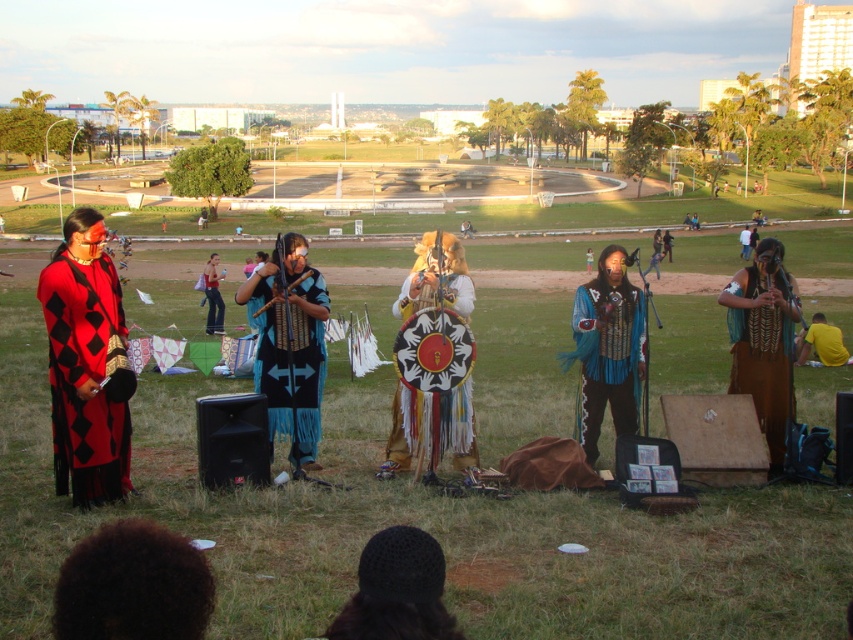
Question: Which of the following is the farthest from the observer?

Choices:
 (A) black knitted hat at lower center
 (B) yellow fabric at lower right
 (C) dark brown curly hair at lower left
 (D) blue fabric shawl at center

Answer: (D)

Question: Estimate the real-world distances between objects in this image. Which object is farther from the red/black checkered fabric at left?

Choices:
 (A) blue fringed vest at center
 (B) blue fringed dress at center
 (C) brown suede skirt at right

Answer: (B)

Question: Can you confirm if blue feathered vest at center is smaller than blue fabric dress at center?

Choices:
 (A) yes
 (B) no

Answer: (A)

Question: Can you confirm if blue fringed vest at center is positioned to the left of brown suede skirt at right?

Choices:
 (A) no
 (B) yes

Answer: (B)

Question: Estimate the real-world distances between objects in this image. Which object is farther from the dark brown curly hair at lower left?

Choices:
 (A) blue fabric dress at center
 (B) blue fabric shawl at center
 (C) multicolored fringed shield at center
 (D) blue fringed dress at center

Answer: (B)

Question: Does brown suede skirt at right have a larger size compared to yellow fabric at lower right?

Choices:
 (A) no
 (B) yes

Answer: (A)